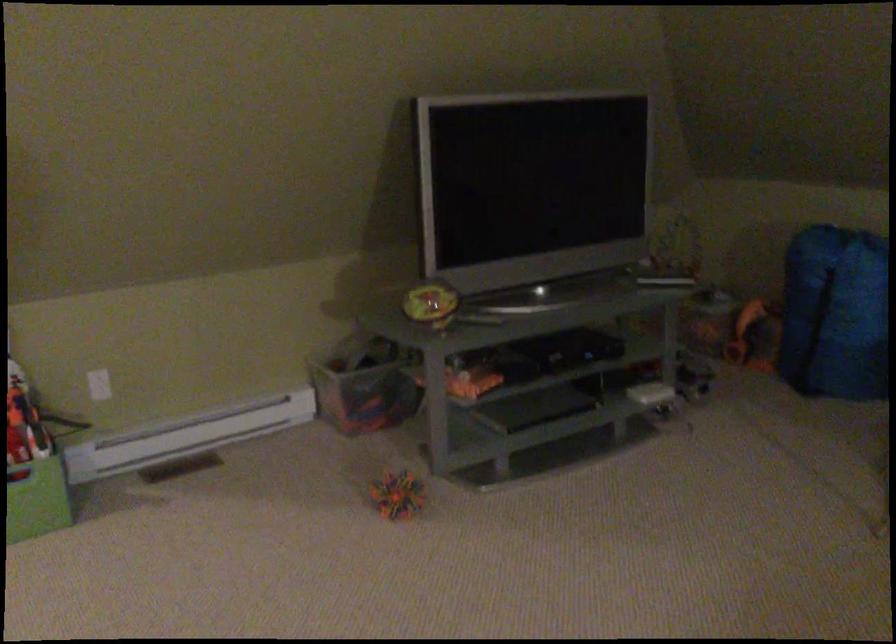
The image size is (896, 644). What do you see at coordinates (364, 384) in the screenshot?
I see `the clear plastic bin` at bounding box center [364, 384].